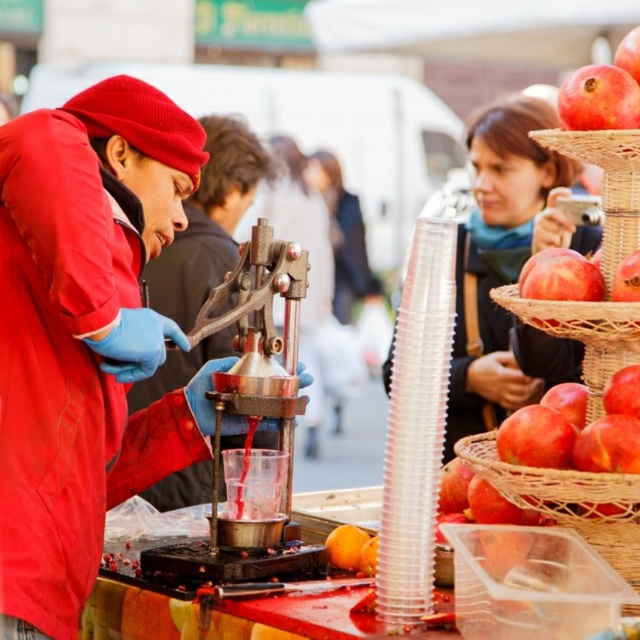
Does matte red jacket at left appear on the right side of pomegranate matte at right?

Incorrect, matte red jacket at left is not on the right side of pomegranate matte at right.

Is matte red jacket at left thinner than pomegranate matte at right?

No.

Is point (109, 240) positioned after point (580, 81)?

That is False.

You are a GUI agent. You are given a task and a screenshot of the screen. Output one action in this format:
    pyautogui.click(x=<x>, y=<y>)
    Task: Click on the matte red jacket at left
    This screenshot has height=640, width=640.
    Given the screenshot: What is the action you would take?
    pyautogui.click(x=84, y=336)

Which is more to the right, matte red jacket at left or matte black phone at upper right?

Positioned to the right is matte black phone at upper right.

Describe the element at coordinates (84, 336) in the screenshot. I see `matte red jacket at left` at that location.

Is point (99, 321) positioned before point (486, 192)?

Yes, point (99, 321) is closer to viewer.

Where is `matte red jacket at left`? matte red jacket at left is located at coordinates (84, 336).

Is matte red jacket at left above red woven basket at right?

Actually, matte red jacket at left is below red woven basket at right.

Locate an element on the screen. Image resolution: width=640 pixels, height=640 pixels. matte red jacket at left is located at coordinates (84, 336).